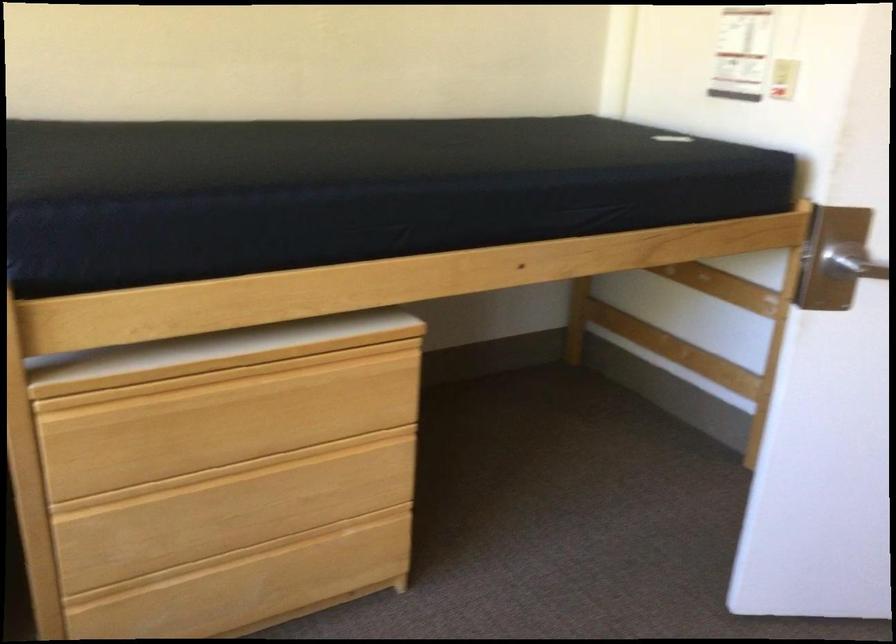
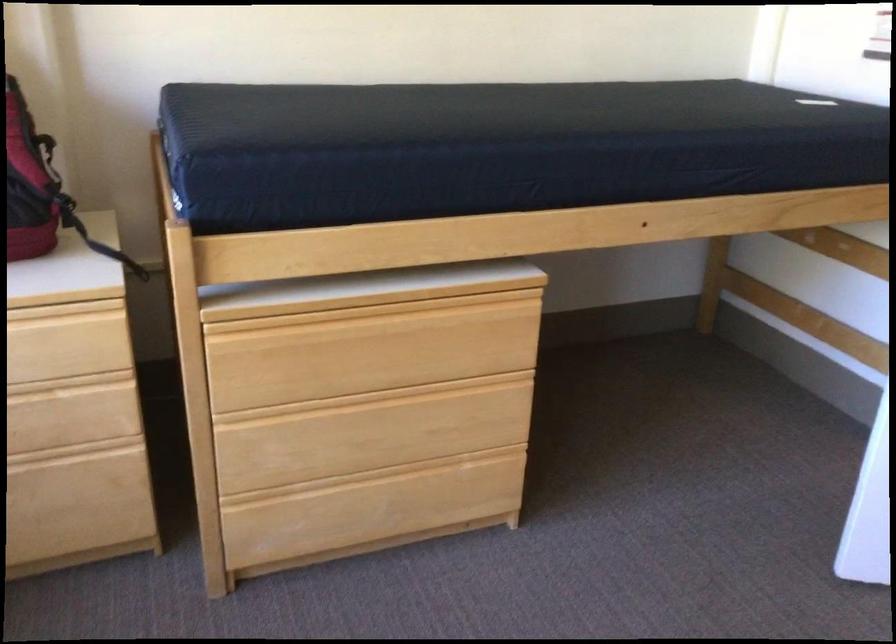
Question: The images are taken continuously from a first-person perspective. In which direction is your viewpoint rotating?

Choices:
 (A) Left
 (B) Right
 (C) Up
 (D) Down

Answer: (A)